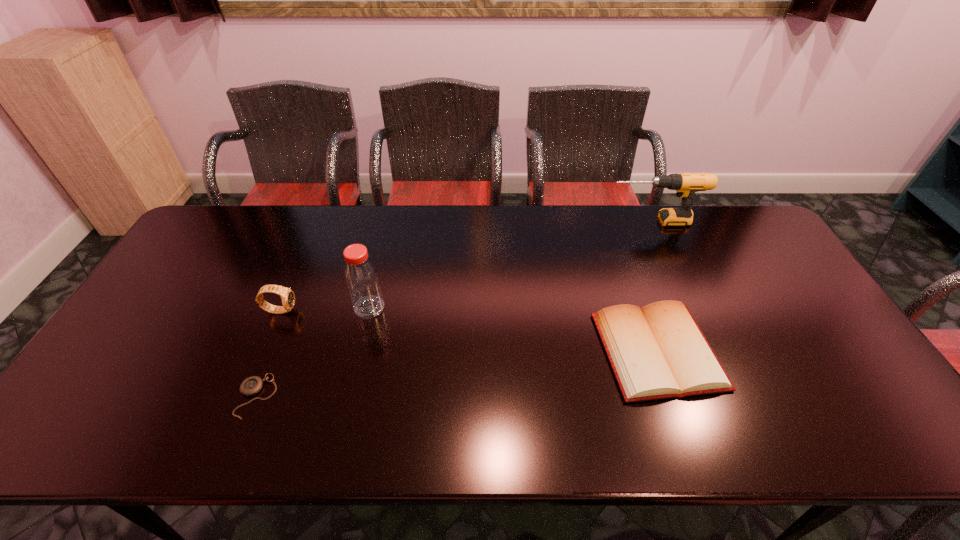
You are a GUI agent. You are given a task and a screenshot of the screen. Output one action in this format:
    pyautogui.click(x=<x>, y=<y>)
    Task: Click on the empty space that is in between the farthest object and the shortest object
    Image resolution: width=960 pixels, height=540 pixels.
    Given the screenshot: What is the action you would take?
    pyautogui.click(x=455, y=309)

Where is `vacant space that is in between the farthest object and the bottle`? The width and height of the screenshot is (960, 540). vacant space that is in between the farthest object and the bottle is located at coordinates (512, 264).

Find the location of `empty location between the third object from left to right and the fourth tallest object`. empty location between the third object from left to right and the fourth tallest object is located at coordinates (514, 329).

The width and height of the screenshot is (960, 540). Identify the location of vacant space that is in between the shortest object and the watch. (268, 353).

Where is `free spot between the fourth tallest object and the shortest object`? free spot between the fourth tallest object and the shortest object is located at coordinates (457, 374).

Locate an element on the screen. Image resolution: width=960 pixels, height=540 pixels. vacant region between the third object from right to left and the fourth tallest object is located at coordinates (514, 329).

Where is `free space between the bottle and the watch`? The height and width of the screenshot is (540, 960). free space between the bottle and the watch is located at coordinates (324, 308).

Find the location of a particular element. vacant area between the watch and the Bible is located at coordinates (468, 330).

The width and height of the screenshot is (960, 540). Identify the location of vacant space that is in between the Bible and the shortest object. pyautogui.click(x=457, y=374).

Where is `vacant space that's between the Bible and the third tallest object`? vacant space that's between the Bible and the third tallest object is located at coordinates (468, 330).